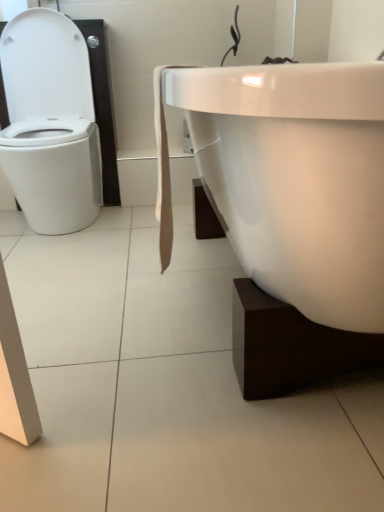
You are a GUI agent. You are given a task and a screenshot of the screen. Output one action in this format:
    pyautogui.click(x=<x>, y=<y>)
    Task: Click on the white glossy bathtub at right
    This screenshot has height=512, width=384.
    Given the screenshot: What is the action you would take?
    pyautogui.click(x=296, y=179)

Image resolution: width=384 pixels, height=512 pixels. Describe the element at coordinates (296, 179) in the screenshot. I see `white glossy bathtub at right` at that location.

What do you see at coordinates (50, 123) in the screenshot?
I see `white glossy toilet at left` at bounding box center [50, 123].

Where is `white glossy toilet at left`? The image size is (384, 512). white glossy toilet at left is located at coordinates (50, 123).

You are a GUI agent. You are given a task and a screenshot of the screen. Output one action in this format:
    pyautogui.click(x=<x>, y=<y>)
    Task: Click on the white glossy bathtub at right
    This screenshot has height=512, width=384.
    Given the screenshot: What is the action you would take?
    pyautogui.click(x=296, y=179)

Can you confirm if white glossy bathtub at right is positioned to the right of white glossy toilet at left?

Correct, you'll find white glossy bathtub at right to the right of white glossy toilet at left.

Is white glossy bathtub at right closer to the viewer compared to white glossy toilet at left?

That is True.

Which is closer to the camera, (313, 111) or (67, 52)?

Point (313, 111).

From the image's perspective, which object appears higher, white glossy bathtub at right or white glossy toilet at left?

From the image's view, white glossy toilet at left is above.

From a real-world perspective, is white glossy bathtub at right positioned under white glossy toilet at left based on gravity?

Yes, from a real-world perspective, white glossy bathtub at right is below white glossy toilet at left.

Is white glossy bathtub at right wider or thinner than white glossy toilet at left?

Considering their sizes, white glossy bathtub at right looks broader than white glossy toilet at left.

Which of these two, white glossy bathtub at right or white glossy toilet at left, stands taller?

white glossy toilet at left is taller.

Looking at the image, does white glossy bathtub at right seem bigger or smaller compared to white glossy toilet at left?

Considering their sizes, white glossy bathtub at right takes up more space than white glossy toilet at left.

Is white glossy bathtub at right outside of white glossy toilet at left?

Yes, white glossy bathtub at right is located beyond the bounds of white glossy toilet at left.

Is white glossy bathtub at right far away from white glossy toilet at left?

No.

Is white glossy bathtub at right looking in the opposite direction of white glossy toilet at left?

That's not correct — white glossy bathtub at right is not looking away from white glossy toilet at left.

Can you tell me how much white glossy bathtub at right and white glossy toilet at left differ in facing direction?

The angular difference between white glossy bathtub at right and white glossy toilet at left is 90.2 degrees.

Measure the distance from white glossy bathtub at right to white glossy toilet at left.

white glossy bathtub at right and white glossy toilet at left are 38.18 inches apart.

Where is `toilet above the white glossy bathtub at right (from a real-world perspective)`? toilet above the white glossy bathtub at right (from a real-world perspective) is located at coordinates (50, 123).

Does white glossy toilet at left appear on the right side of white glossy bathtub at right?

Incorrect, white glossy toilet at left is not on the right side of white glossy bathtub at right.

Is white glossy toilet at left further to camera compared to white glossy bathtub at right?

Yes, white glossy toilet at left is behind white glossy bathtub at right.

Between point (16, 78) and point (343, 296), which one is positioned behind?

The point (16, 78) is farther.

From the image's perspective, is white glossy toilet at left above white glossy bathtub at right?

Yes, from the image's perspective, white glossy toilet at left is above white glossy bathtub at right.

From a real-world perspective, is white glossy toilet at left above or below white glossy bathtub at right?

Clearly, from a real-world perspective, white glossy toilet at left is above white glossy bathtub at right.

Can you confirm if white glossy toilet at left is wider than white glossy bathtub at right?

In fact, white glossy toilet at left might be narrower than white glossy bathtub at right.

In terms of height, does white glossy toilet at left look taller or shorter compared to white glossy bathtub at right?

white glossy toilet at left is taller than white glossy bathtub at right.

Does white glossy toilet at left have a smaller size compared to white glossy bathtub at right?

Yes, white glossy toilet at left is smaller than white glossy bathtub at right.

Can we say white glossy toilet at left lies outside white glossy bathtub at right?

Indeed, white glossy toilet at left is completely outside white glossy bathtub at right.

Is white glossy toilet at left next to white glossy bathtub at right and touching it?

There is a gap between white glossy toilet at left and white glossy bathtub at right.

Is white glossy toilet at left turned away from white glossy bathtub at right?

white glossy toilet at left is not turned away from white glossy bathtub at right.

You are a GUI agent. You are given a task and a screenshot of the screen. Output one action in this format:
    pyautogui.click(x=<x>, y=<y>)
    Task: Click on the sink to the right of white glossy toilet at left
    The image size is (384, 512).
    Given the screenshot: What is the action you would take?
    pyautogui.click(x=296, y=179)

Identify the location of toilet that appears above the white glossy bathtub at right (from the image's perspective). (50, 123).

Where is `toilet above the white glossy bathtub at right (from a real-world perspective)`? toilet above the white glossy bathtub at right (from a real-world perspective) is located at coordinates (50, 123).